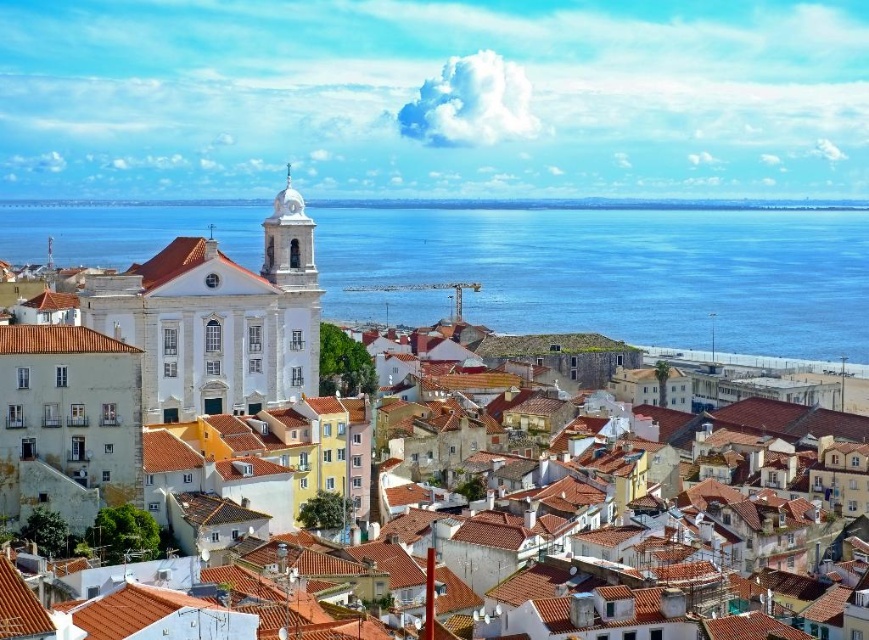
You are standing at the edge of the coastal city and want to take a photo of both the blue water at center and the white smooth church at upper center. Based on their positions, which one would appear larger in the photo?

The blue water at center appears larger in the photo because it is closer to the viewer than the white smooth church at upper center.

You are standing at the camera position and want to reach point (x=838, y=340). Is the distance more than 300 meters?

Yes, the distance between the camera and point (x=838, y=340) is 397.66 meters, which is more than 300 meters.

Based on the coordinates provided, what is located at point (614, 273) in the image?

The point at (614, 273) is blue water at center.